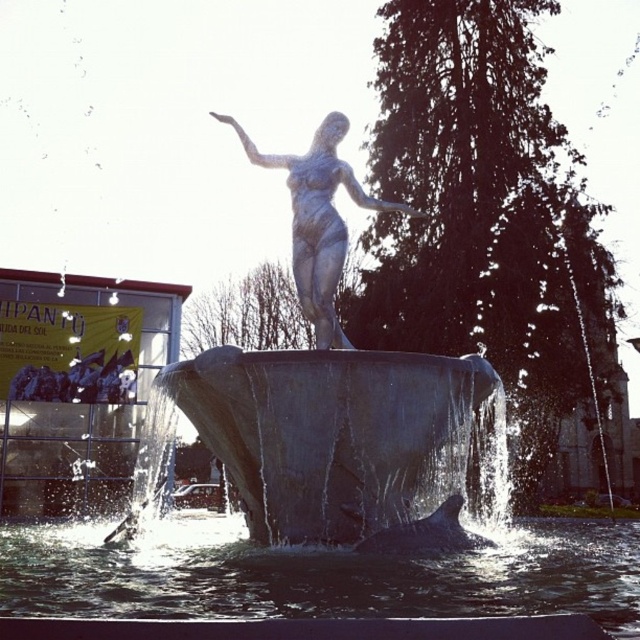
From the picture: You are a photographer planning to capture the fountain sculpture. You want to ensure the clear water at center and the satin silver statue at center are both visible in your shot. Given that your camera has a fixed focal length, which object should you prioritize framing closer to the center of the photo to include both?

The clear water at center is bigger than the satin silver statue at center, so you should prioritize framing the satin silver statue at center closer to the center of the photo to ensure both are visible while accommodating the larger size of the water.

You are a maintenance worker inspecting the fountain. You notice the satin silver statue at center and the clear water at center. Which object is located below the other?

The clear water at center is positioned under the satin silver statue at center, so the clear water is below the statue.

You are standing in front of the fountain sculpture and want to take a photo of the statue. The camera you are using has a maximum focus range of 20 meters. Will the point at coordinates point (x=100, y=586) be within the camera focus range?

The point at coordinates point (x=100, y=586) is 19.40 meters from the camera, which is within the maximum focus range of 20 meters. Therefore, the camera can focus on that point.